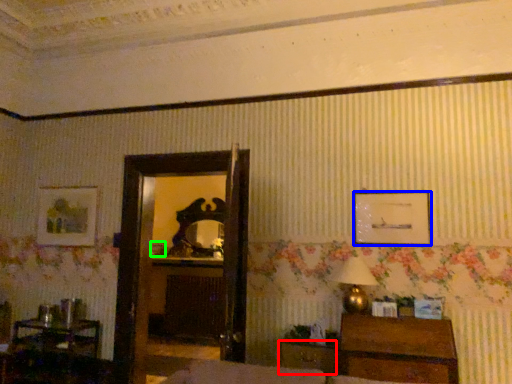
Question: Considering the real-world distances, which object is closest to drawer (highlighted by a red box)? picture frame (highlighted by a blue box) or picture frame (highlighted by a green box).

Choices:
 (A) picture frame
 (B) picture frame

Answer: (A)